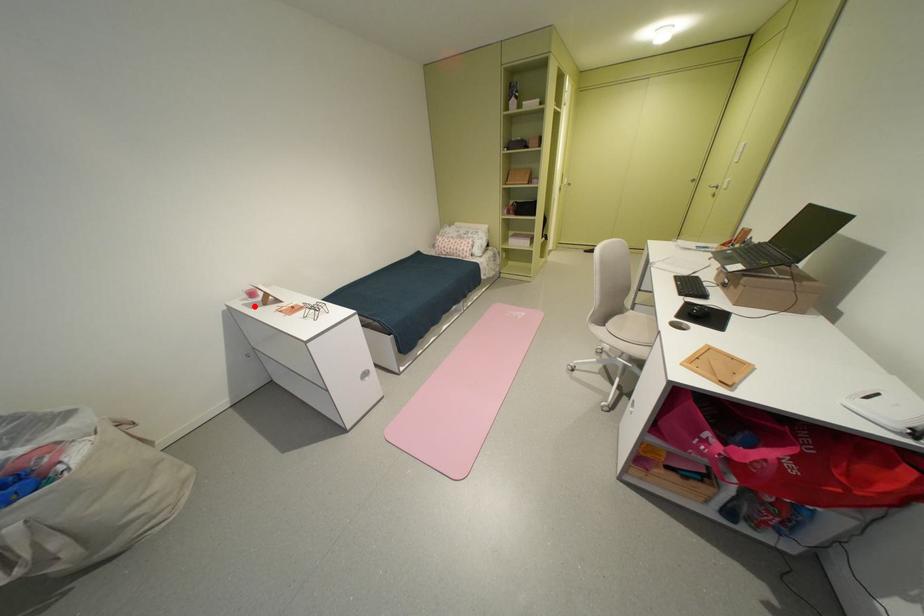
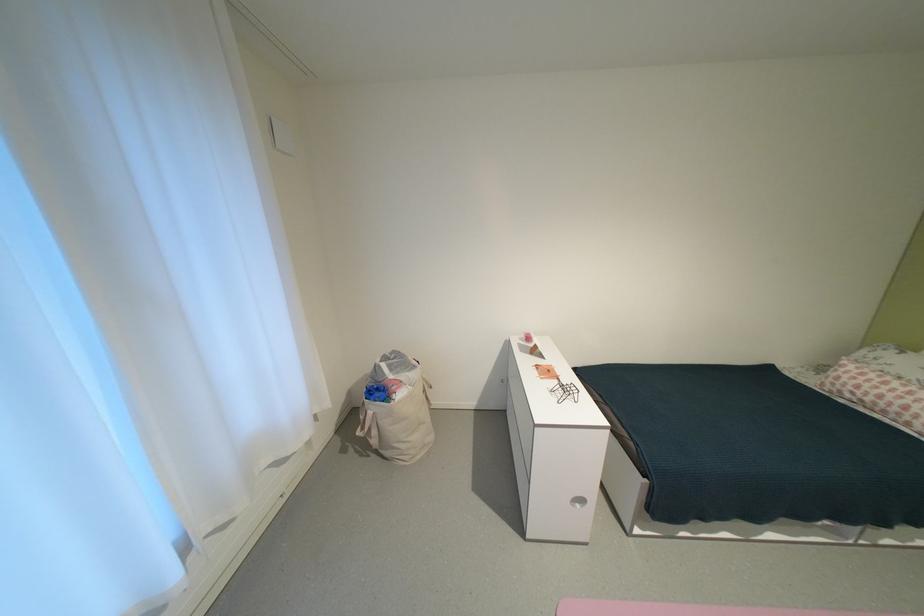
The point at the highlighted location is marked in the first image. Where is the corresponding point in the second image?

(529, 346)